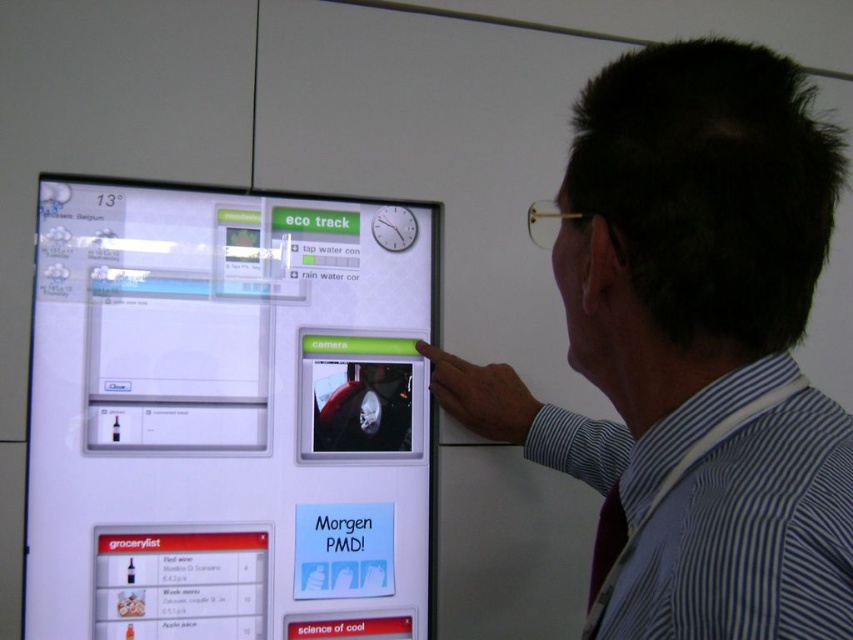
You are standing in front of the interactive touch screen display. The transparent glass screen at upper left has a coordinate of point 0.648, 0.268. If you want to touch the top left corner of the screen, where should you aim your finger?

The transparent glass screen at upper left is located at point (228, 413), so you should aim your finger at that coordinate to touch the top left corner of the screen.

You are standing in front of the interactive touch screen display. You notice the transparent glass screen at upper left and the striped shirt at upper right. Which object is wider?

The transparent glass screen at upper left is wider than the striped shirt at upper right.

Based on the photo, you are standing in front of the interactive touch screen display. You notice the transparent glass screen at upper left and the striped shirt at upper right. Which object is taller?

The transparent glass screen at upper left is much taller than the striped shirt at upper right.